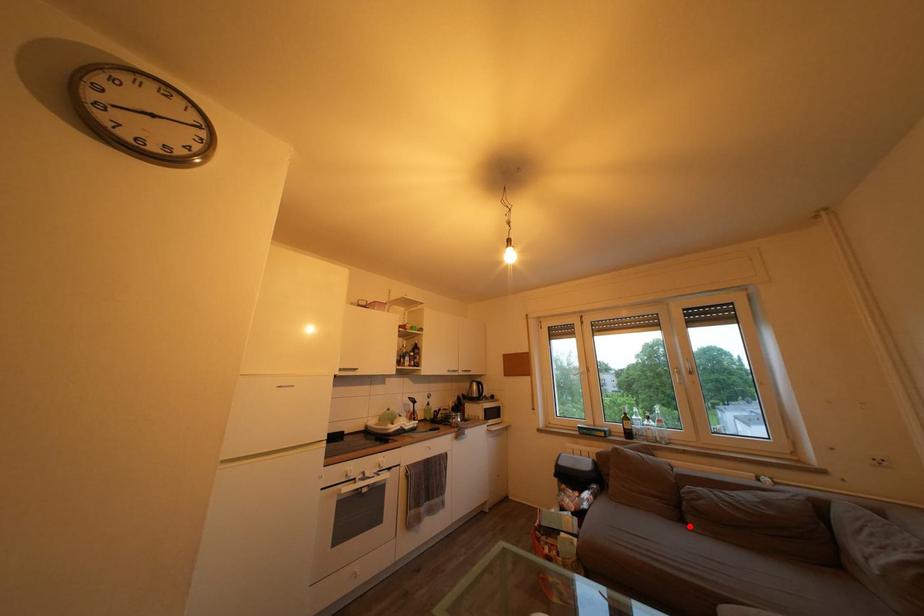
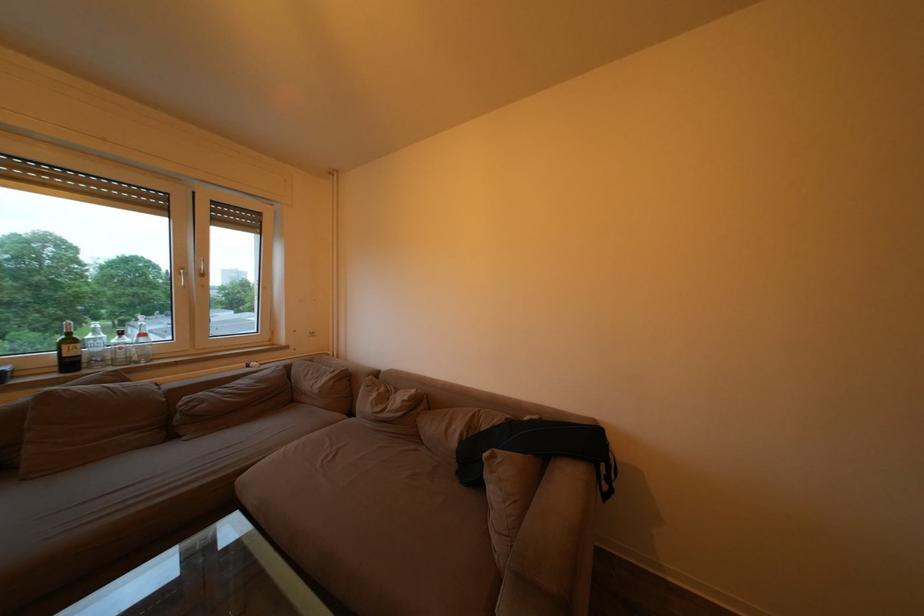
Where in the second image is the point corresponding to the highlighted location from the first image?

(178, 443)